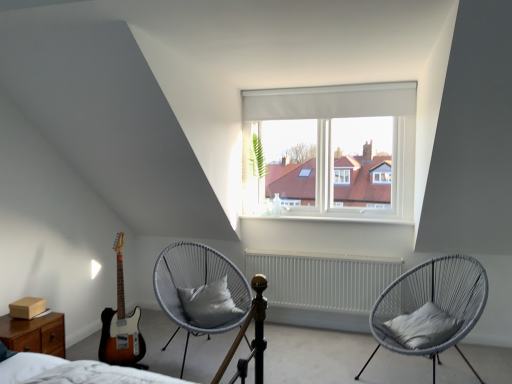
Question: Is gray woven chair at center, which is counted as the second chair, starting from the left, oriented towards brown wood nightstand at lower left?

Choices:
 (A) yes
 (B) no

Answer: (B)

Question: From the image's perspective, is gray woven chair at center, which is counted as the second chair, starting from the left, on brown wood nightstand at lower left?

Choices:
 (A) no
 (B) yes

Answer: (B)

Question: Considering the relative sizes of gray woven chair at center, the first chair when ordered from right to left, and brown wood nightstand at lower left in the image provided, is gray woven chair at center, the first chair when ordered from right to left, smaller than brown wood nightstand at lower left?

Choices:
 (A) no
 (B) yes

Answer: (A)

Question: Can you confirm if gray woven chair at center, the first chair when ordered from right to left, is bigger than brown wood nightstand at lower left?

Choices:
 (A) no
 (B) yes

Answer: (B)

Question: Is brown wood nightstand at lower left surrounded by gray woven chair at center, the first chair when ordered from right to left?

Choices:
 (A) yes
 (B) no

Answer: (B)

Question: Is there a large distance between gray woven chair at center, which is counted as the second chair, starting from the left, and brown wood nightstand at lower left?

Choices:
 (A) no
 (B) yes

Answer: (B)

Question: From the image's perspective, is brown wood nightstand at lower left below gray woven chair with cushion at center, the 2th chair when ordered from right to left?

Choices:
 (A) no
 (B) yes

Answer: (B)

Question: Can you confirm if brown wood nightstand at lower left is shorter than gray woven chair with cushion at center, acting as the 1th chair starting from the left?

Choices:
 (A) no
 (B) yes

Answer: (B)

Question: Considering the relative positions of brown wood nightstand at lower left and gray woven chair with cushion at center, acting as the 1th chair starting from the left, in the image provided, is brown wood nightstand at lower left to the right of gray woven chair with cushion at center, acting as the 1th chair starting from the left, from the viewer's perspective?

Choices:
 (A) no
 (B) yes

Answer: (A)

Question: Is brown wood nightstand at lower left looking in the opposite direction of gray woven chair with cushion at center, the 2th chair when ordered from right to left?

Choices:
 (A) yes
 (B) no

Answer: (B)

Question: Considering the relative sizes of brown wood nightstand at lower left and gray woven chair with cushion at center, acting as the 1th chair starting from the left, in the image provided, is brown wood nightstand at lower left taller than gray woven chair with cushion at center, acting as the 1th chair starting from the left,?

Choices:
 (A) yes
 (B) no

Answer: (B)

Question: Considering the relative sizes of brown wood nightstand at lower left and gray woven chair with cushion at center, the 2th chair when ordered from right to left, in the image provided, is brown wood nightstand at lower left thinner than gray woven chair with cushion at center, the 2th chair when ordered from right to left,?

Choices:
 (A) yes
 (B) no

Answer: (A)

Question: Are sunburst wood guitar at left and gray woven chair at center, the first chair when ordered from right to left, beside each other?

Choices:
 (A) no
 (B) yes

Answer: (A)